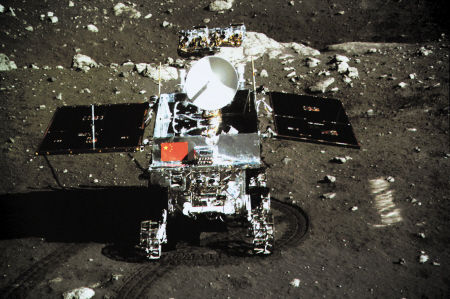
You are a GUI agent. You are given a task and a screenshot of the screen. Output one action in this format:
    pyautogui.click(x=<x>, y=<y>)
    Task: Click on the panel
    The image size is (450, 299).
    Given the screenshot: What is the action you would take?
    pyautogui.click(x=121, y=125), pyautogui.click(x=320, y=108)